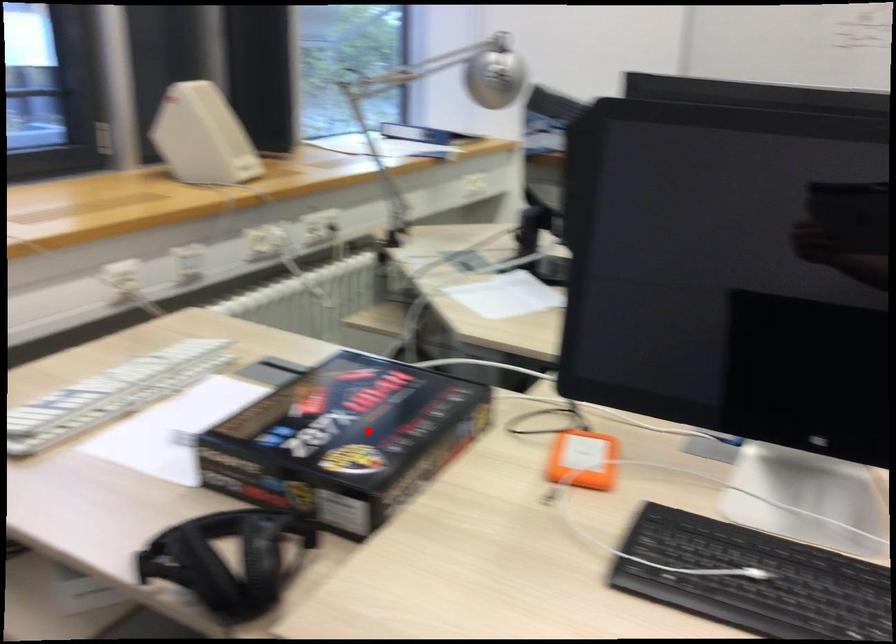
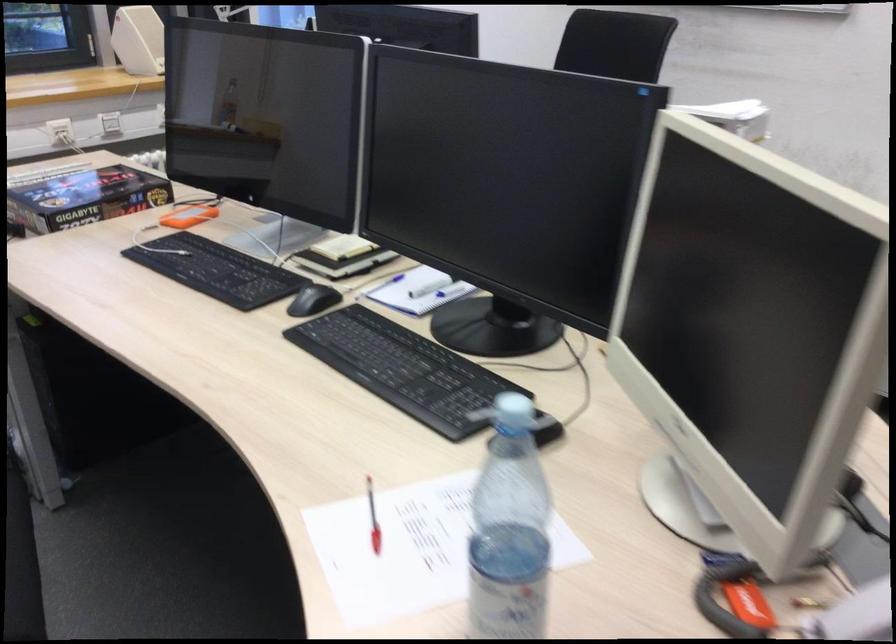
In the second image, find the point that corresponds to the highlighted location in the first image.

(83, 198)